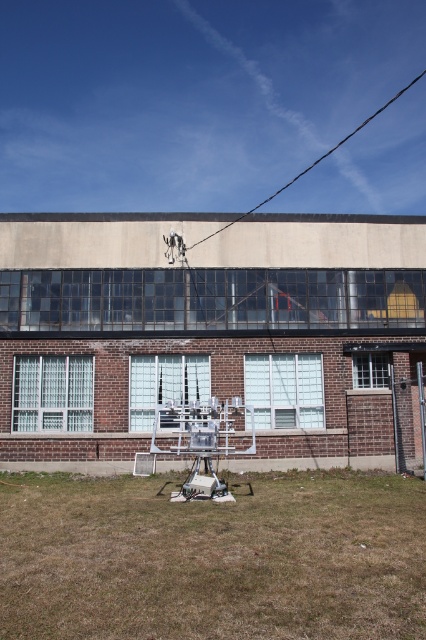
You are standing 5 meters away from the building and want to check the condition of the brown dry grass at lower center. Can you reach it without moving closer?

The brown dry grass at lower center is 4.63 meters from the camera, so if you are standing 5 meters away from the building, you are slightly farther than the grass. Therefore, you cannot reach it without moving closer.

You are a gardener assessing the lawn in front of a two story building. You notice brown dry grass at lower center and black wire at upper center. Which object is wider?

The brown dry grass at lower center is less than black wire at upper center in width, so the black wire at upper center is wider.